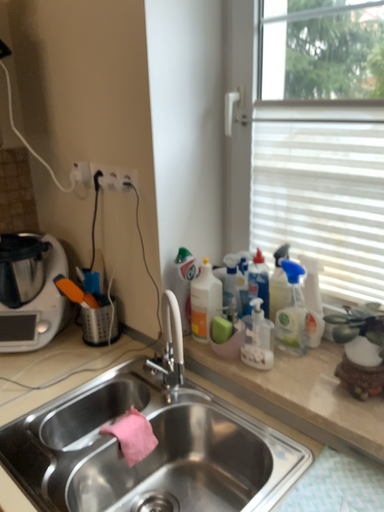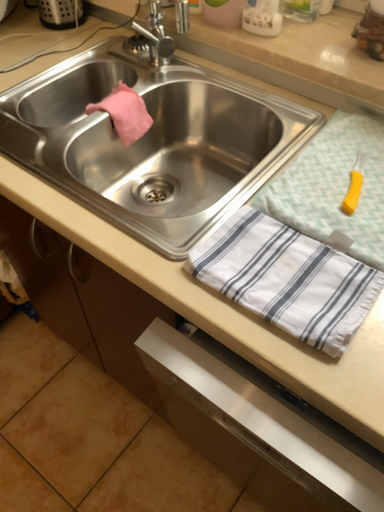
Question: Which way did the camera rotate in the video?

Choices:
 (A) rotated upward
 (B) rotated downward

Answer: (B)